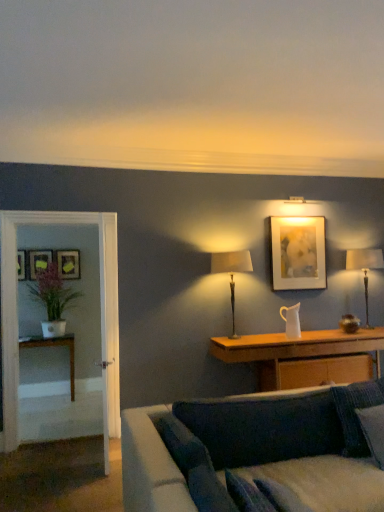
Question: Looking at the image, does matte black picture frame at left, the fourth picture frame viewed from the right, seem bigger or smaller compared to clear glass door at left?

Choices:
 (A) big
 (B) small

Answer: (B)

Question: Considering the relative positions of matte black picture frame at left, which is the second picture frame from front to back, and clear glass door at left in the image provided, is matte black picture frame at left, which is the second picture frame from front to back, to the left or to the right of clear glass door at left?

Choices:
 (A) left
 (B) right

Answer: (A)

Question: Which object is positioned farthest from the green matte plant at left?

Choices:
 (A) matte white picture frame at upper right, the 1th picture frame from the front
 (B) velvet dark blue couch at lower center
 (C) clear glass door at left
 (D) wooden cabinet at center, arranged as the 2th table when viewed from the left
 (E) matte black picture frame at left, which appears as the third picture frame when viewed from the back

Answer: (B)

Question: Which object is positioned closest to the matte black picture frame at left, the fourth picture frame viewed from the right?

Choices:
 (A) white glossy table at left, acting as the first table starting from the left
 (B) wooden picture frame at left, the first picture frame viewed from the back
 (C) wooden cabinet at center, acting as the 2th table starting from the back
 (D) dark blue fabric pillow at lower right
 (E) velvet dark blue couch at lower center

Answer: (B)